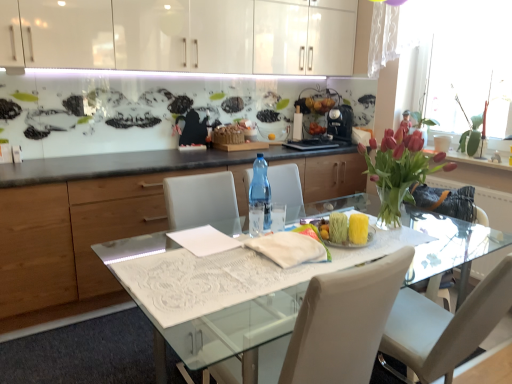
The height and width of the screenshot is (384, 512). I want to click on space that is in front of transparent glass cup at center, so click(x=245, y=246).